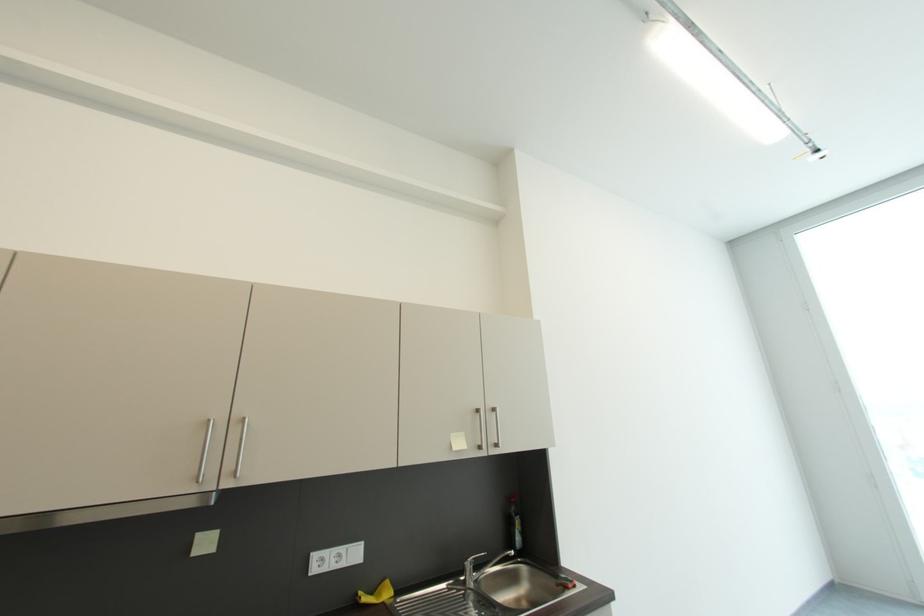
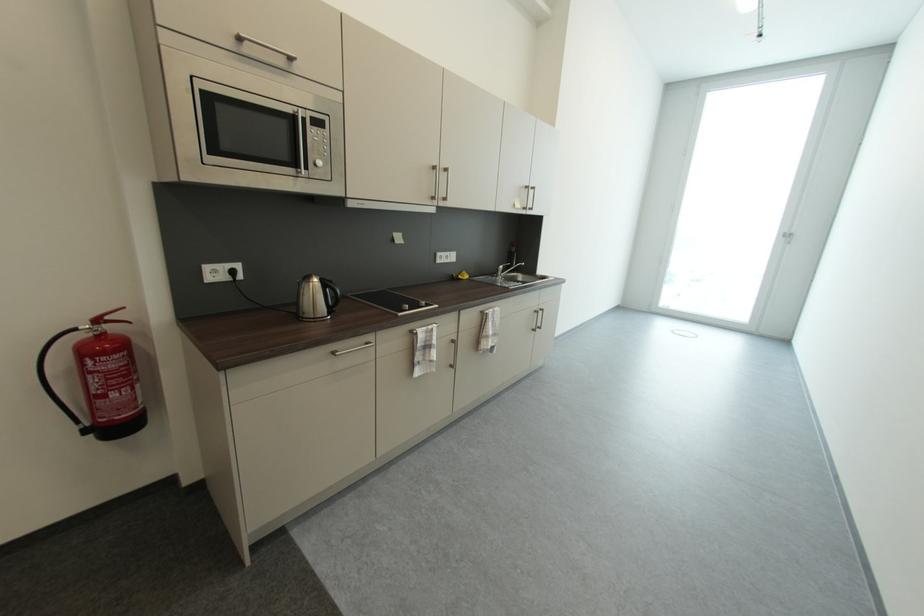
Find the pixel in the second image that matches (468,580) in the first image.

(502, 277)